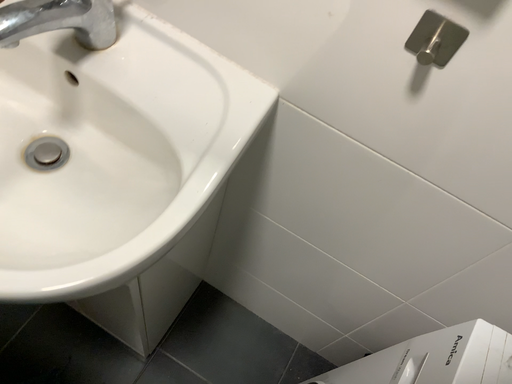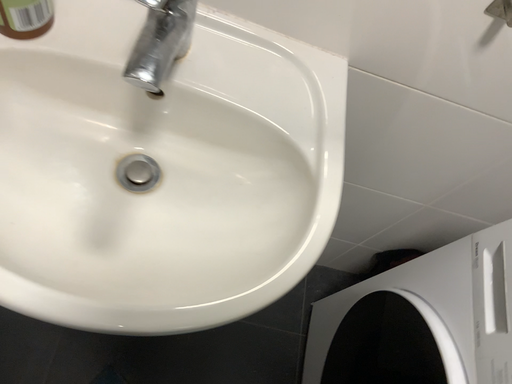
Question: How did the camera likely rotate when shooting the video?

Choices:
 (A) rotated upward
 (B) rotated downward

Answer: (B)